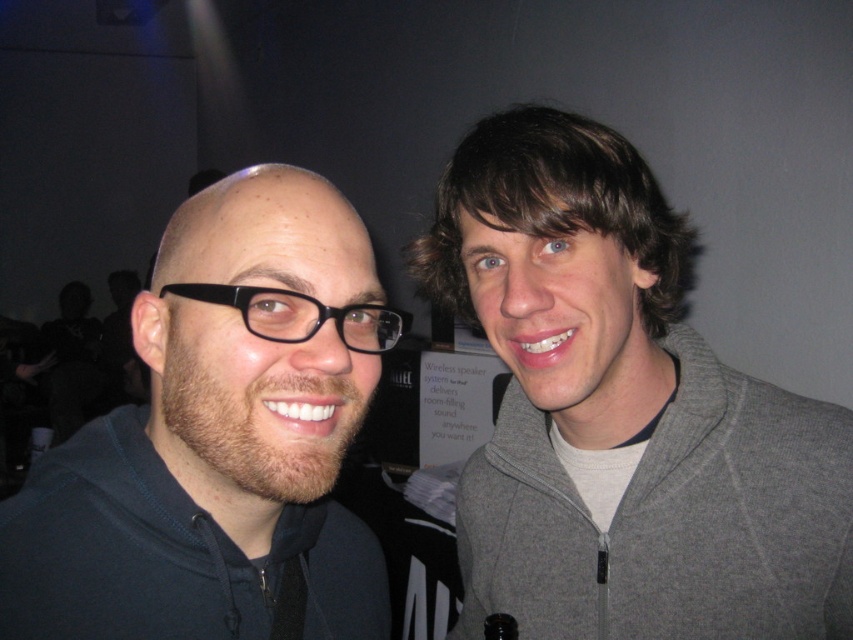
Who is positioned more to the right, matte black hoodie at left or gray fleece jacket at right?

gray fleece jacket at right

Based on the photo, is matte black hoodie at left closer to camera compared to gray fleece jacket at right?

Yes, matte black hoodie at left is closer to the viewer.

Between point (207, 269) and point (819, 404), which one is positioned behind?

Positioned behind is point (819, 404).

At what (x,y) coordinates should I click in order to perform the action: click on matte black hoodie at left. Please return your answer as a coordinate pair (x, y). The height and width of the screenshot is (640, 853). Looking at the image, I should click on (219, 440).

Is point (798, 620) more distant than point (305, 298)?

Yes.

Between gray fleece jacket at right and black plastic glasses at center, which one is positioned lower?

gray fleece jacket at right

The height and width of the screenshot is (640, 853). What do you see at coordinates (668, 518) in the screenshot? I see `gray fleece jacket at right` at bounding box center [668, 518].

Identify the location of gray fleece jacket at right. This screenshot has width=853, height=640. (668, 518).

Can you confirm if matte black hoodie at left is positioned above black plastic glasses at center?

No.

The width and height of the screenshot is (853, 640). What are the coordinates of `matte black hoodie at left` in the screenshot? It's located at (219, 440).

Who is more distant from viewer, (257, 611) or (186, 291)?

The point (257, 611) is more distant.

This screenshot has height=640, width=853. In order to click on matte black hoodie at left in this screenshot , I will do `click(219, 440)`.